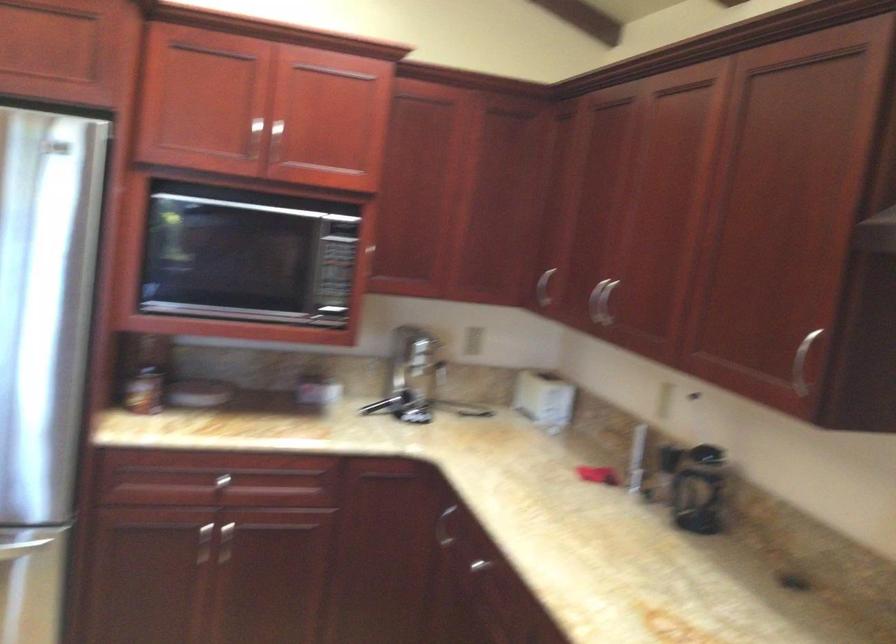
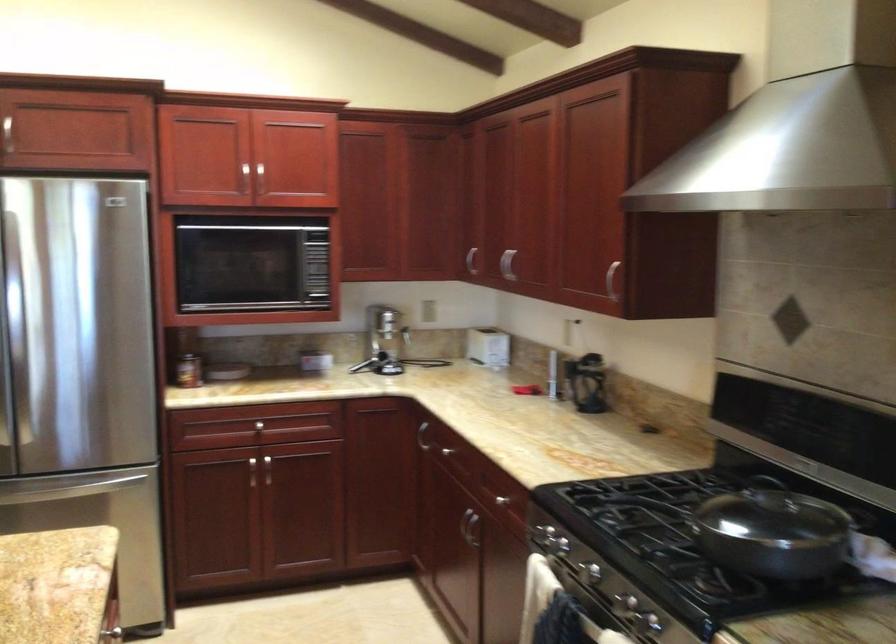
In the second image, find the point that corresponds to (545,289) in the first image.

(471, 261)